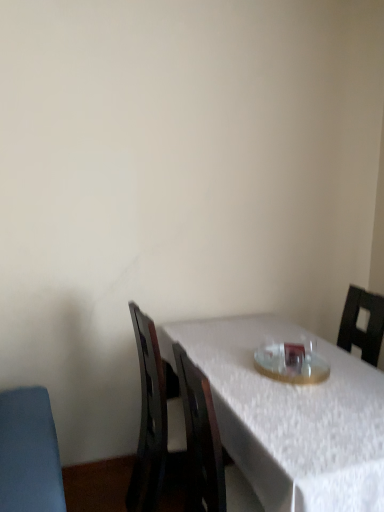
You are a GUI agent. You are given a task and a screenshot of the screen. Output one action in this format:
    pyautogui.click(x=<x>, y=<y>)
    Task: Click on the vacant space situated above white textured table at center (from a real-world perspective)
    The height and width of the screenshot is (512, 384).
    Given the screenshot: What is the action you would take?
    [x=262, y=362]